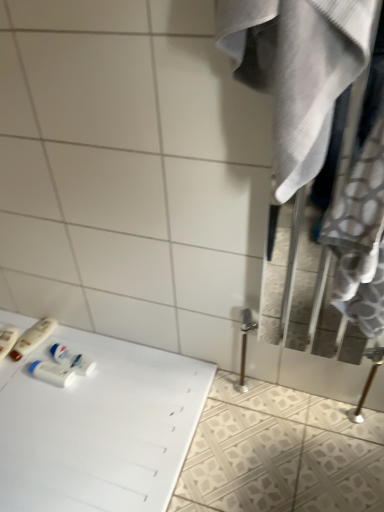
Question: Considering the positions of white glossy table at lower left and white fabric closet at right in the image, is white glossy table at lower left wider or thinner than white fabric closet at right?

Choices:
 (A) wide
 (B) thin

Answer: (A)

Question: From the image's perspective, relative to white fabric closet at right, is white glossy table at lower left above or below?

Choices:
 (A) above
 (B) below

Answer: (B)

Question: Estimate the real-world distances between objects in this image. Which object is closer to the white plastic tube at lower left, which is the 1th toiletry from right to left?

Choices:
 (A) matte plastic toothbrush at lower left, the first toiletry in the left-to-right sequence
 (B) white glossy table at lower left
 (C) white plastic mouthwash at lower left
 (D) white fabric closet at right
 (E) white plastic bottles at lower left, which ranks as the second toiletry in right-to-left order

Answer: (C)

Question: Considering the real-world distances, which object is farthest from the white plastic bottles at lower left, which ranks as the second toiletry in right-to-left order?

Choices:
 (A) white plastic mouthwash at lower left
 (B) white glossy table at lower left
 (C) matte plastic toothbrush at lower left, acting as the 3th toiletry starting from the right
 (D) white fabric closet at right
 (E) white plastic tube at lower left, the 3th toiletry when ordered from left to right

Answer: (D)